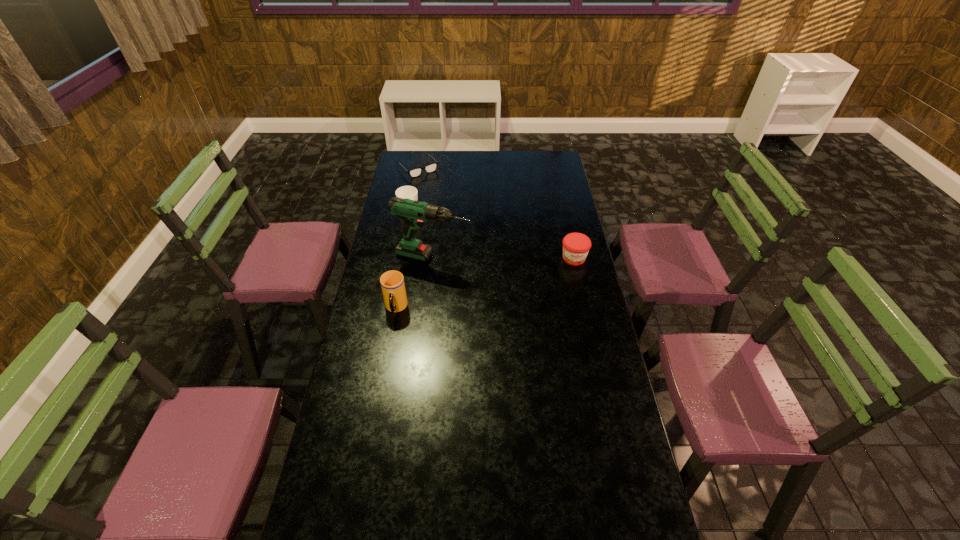
The height and width of the screenshot is (540, 960). I want to click on drill located at the left edge, so click(414, 213).

Locate an element on the screen. The width and height of the screenshot is (960, 540). spectacles that is at the left edge is located at coordinates pyautogui.click(x=415, y=172).

Where is `object that is at the right edge`? object that is at the right edge is located at coordinates (576, 246).

Image resolution: width=960 pixels, height=540 pixels. Find the location of `object at the far left corner`. object at the far left corner is located at coordinates (415, 172).

You are a GUI agent. You are given a task and a screenshot of the screen. Output one action in this format:
    pyautogui.click(x=<x>, y=<y>)
    Task: Click on the blank area at the far edge
    The width and height of the screenshot is (960, 540).
    Given the screenshot: What is the action you would take?
    pyautogui.click(x=504, y=161)

At what (x,y) coordinates should I click in order to perform the action: click on vacant region at the left edge of the desktop. Please return your answer as a coordinate pair (x, y). This screenshot has width=960, height=540. Looking at the image, I should click on (379, 347).

The height and width of the screenshot is (540, 960). In the image, there is a desktop. Find the location of `free space at the right edge`. free space at the right edge is located at coordinates (549, 188).

This screenshot has height=540, width=960. In the image, there is a desktop. Find the location of `vacant space at the far left corner`. vacant space at the far left corner is located at coordinates (427, 163).

The image size is (960, 540). I want to click on vacant space that's between the shorter cup and the jam, so click(492, 235).

Identify the location of free area in between the shortest object and the rightmost object. (496, 213).